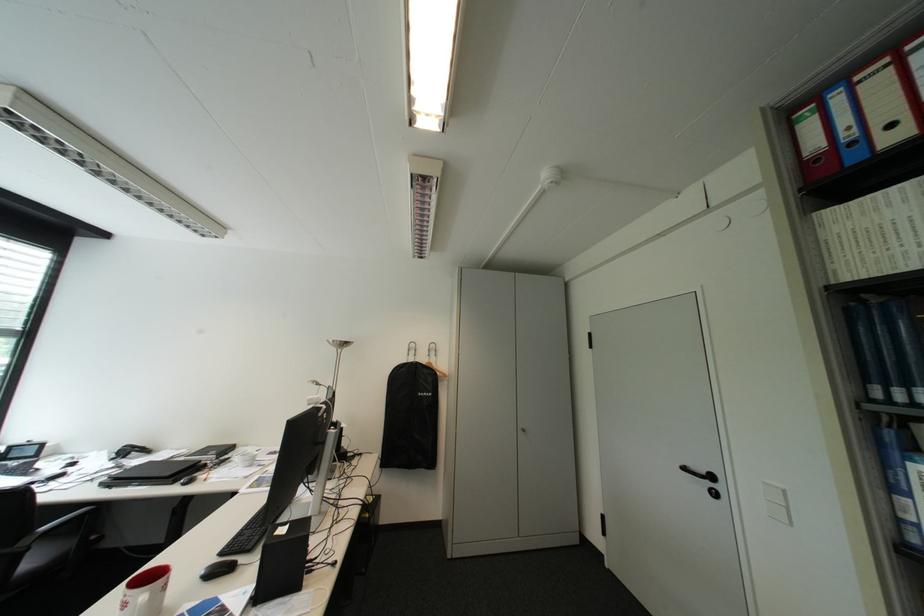
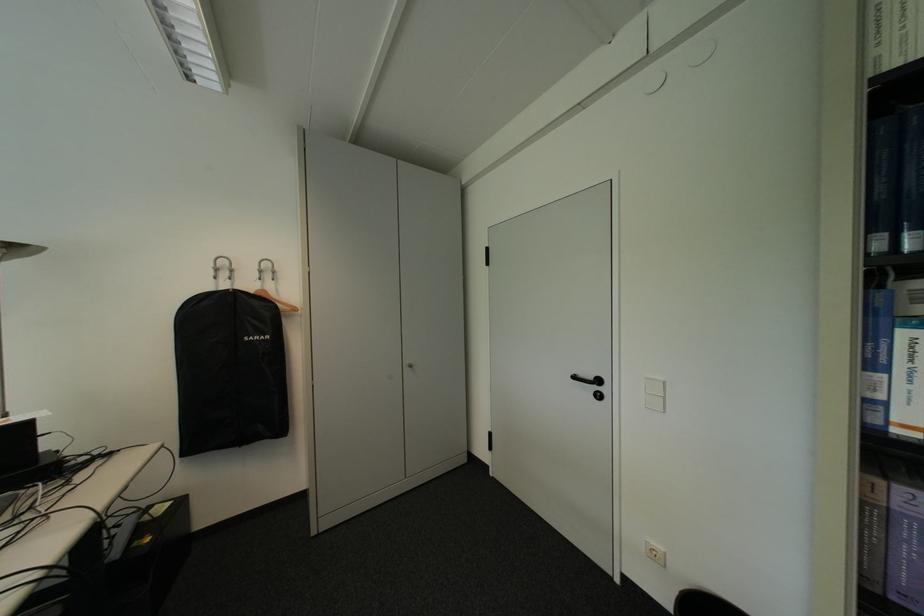
Question: The images are taken continuously from a first-person perspective. In which direction is your viewpoint rotating?

Choices:
 (A) Left
 (B) Right
 (C) Up
 (D) Down

Answer: (B)